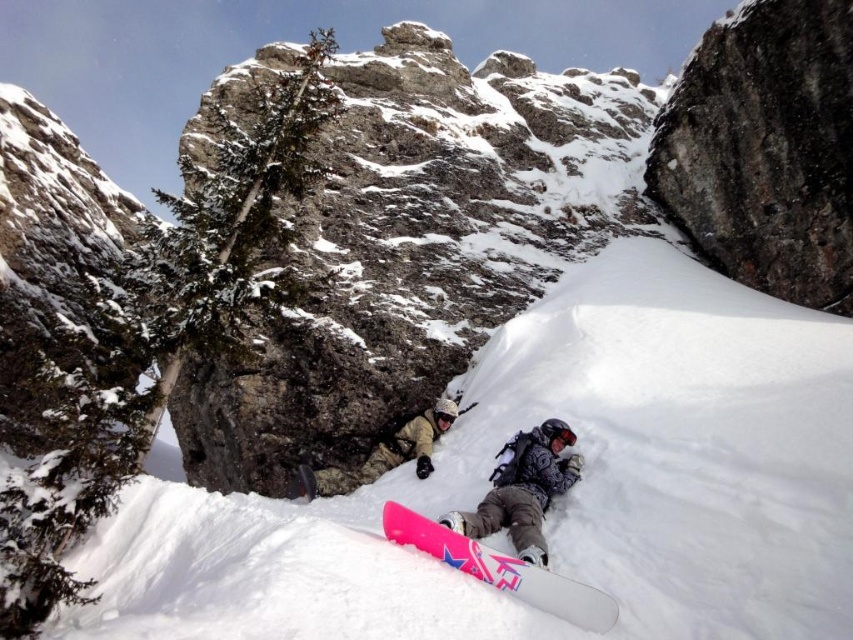
Which is more to the right, matte black snowboard at lower center or camouflage fabric person at center?

From the viewer's perspective, matte black snowboard at lower center appears more on the right side.

Measure the distance from matte black snowboard at lower center to camouflage fabric person at center.

13.94 meters

Describe the element at coordinates (523, 490) in the screenshot. I see `matte black snowboard at lower center` at that location.

Find the location of `matte black snowboard at lower center`. matte black snowboard at lower center is located at coordinates (523, 490).

Who is positioned more to the right, pink matte snowboard at lower center or camouflage fabric person at center?

A: pink matte snowboard at lower center

Is point (434, 524) positioned in front of point (407, 456)?

That is True.

Between point (438, 531) and point (421, 416), which one is positioned in front?

Point (438, 531)

Identify the location of pink matte snowboard at lower center. The height and width of the screenshot is (640, 853). (502, 570).

Does matte black snowboard at lower center appear over pink matte snowboard at lower center?

Yes, matte black snowboard at lower center is above pink matte snowboard at lower center.

Measure the distance between point (529, 538) and camera.

Point (529, 538) and camera are 51.88 meters apart.

Find the location of a particular element. matte black snowboard at lower center is located at coordinates (523, 490).

The width and height of the screenshot is (853, 640). In order to click on matte black snowboard at lower center in this screenshot , I will do `click(523, 490)`.